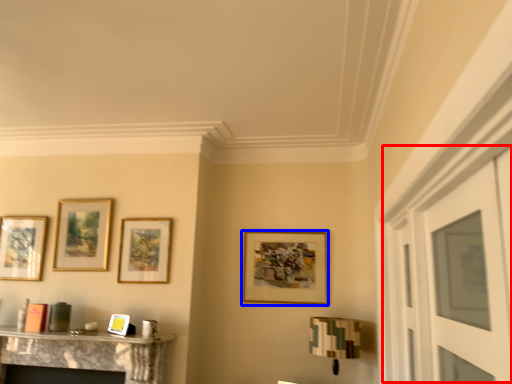
Question: Which of the following is the closest to the observer, glass door (highlighted by a red box) or picture frame (highlighted by a blue box)?

Choices:
 (A) glass door
 (B) picture frame

Answer: (A)